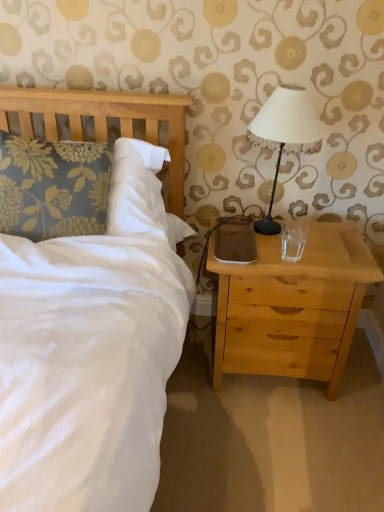
Find the location of `vacant space situated above brown matte pad at right (from a real-world perspective)`. vacant space situated above brown matte pad at right (from a real-world perspective) is located at coordinates (238, 233).